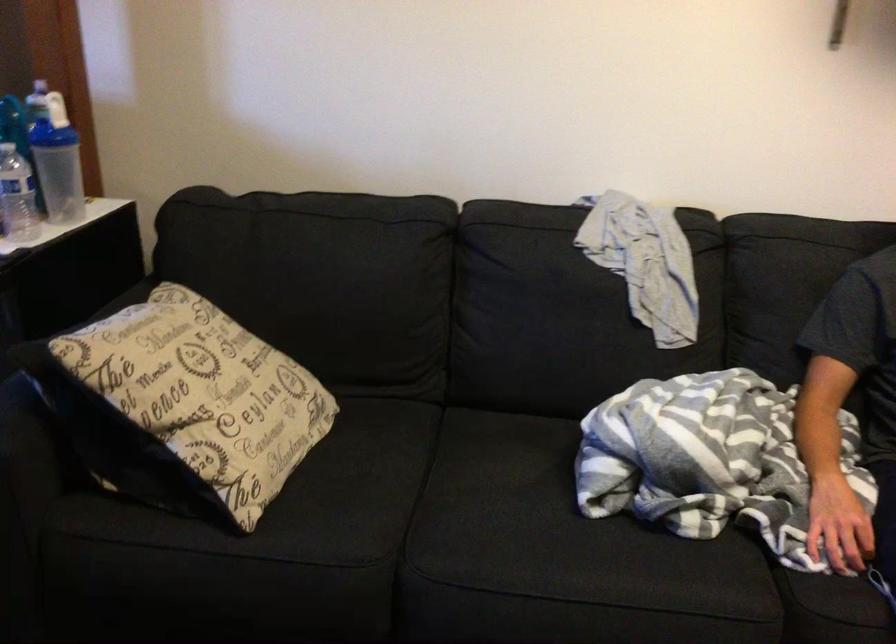
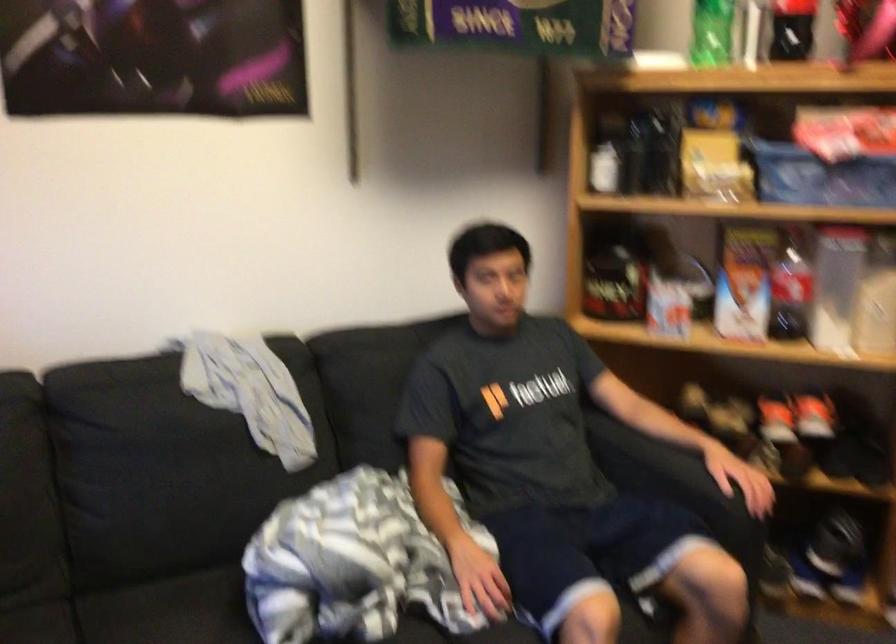
Question: The camera is either moving clockwise (left) or counter-clockwise (right) around the object. The first image is from the beginning of the video and the second image is from the end. Is the camera moving left or right when shooting the video?

Choices:
 (A) Left
 (B) Right

Answer: (A)